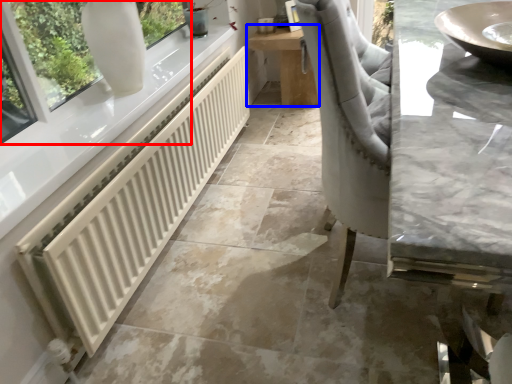
Question: Which object is closer to the camera taking this photo, window (highlighted by a red box) or table (highlighted by a blue box)?

Choices:
 (A) window
 (B) table

Answer: (A)